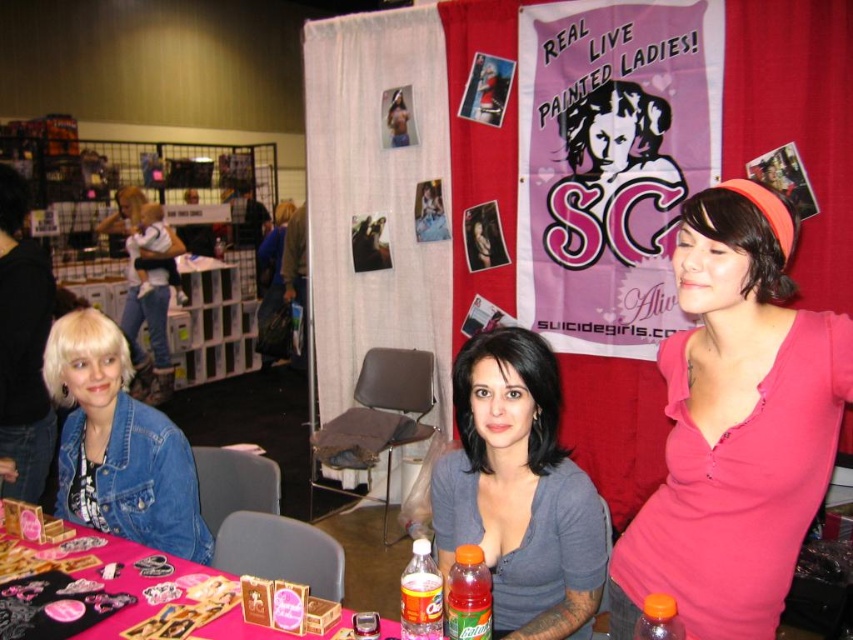
Question: Which object appears farthest from the camera in this image?

Choices:
 (A) denim jacket at lower left
 (B) orange plastic bottle at lower center
 (C) matte pink banner at upper center
 (D) pink fabric table at lower left

Answer: (C)

Question: Is pink fabric shirt at right smaller than pink fabric table at lower left?

Choices:
 (A) no
 (B) yes

Answer: (A)

Question: Which point is closer to the camera?

Choices:
 (A) [x=554, y=83]
 (B) [x=216, y=630]
 (C) [x=86, y=490]

Answer: (B)

Question: Which point is farther from the camera taking this photo?

Choices:
 (A) (222, 554)
 (B) (662, 628)
 (C) (440, 596)

Answer: (A)

Question: From the image, what is the correct spatial relationship of pink fabric table at lower left in relation to translucent plastic soda bottle at center?

Choices:
 (A) above
 (B) below

Answer: (B)

Question: Considering the relative positions of pink fabric shirt at right and matte pink banner at upper center in the image provided, where is pink fabric shirt at right located with respect to matte pink banner at upper center?

Choices:
 (A) above
 (B) below

Answer: (B)